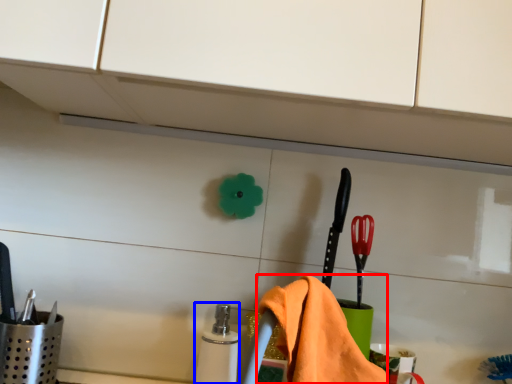
Question: Which of the following is the closest to the observer, bath towel (highlighted by a red box) or toiletry (highlighted by a blue box)?

Choices:
 (A) bath towel
 (B) toiletry

Answer: (A)